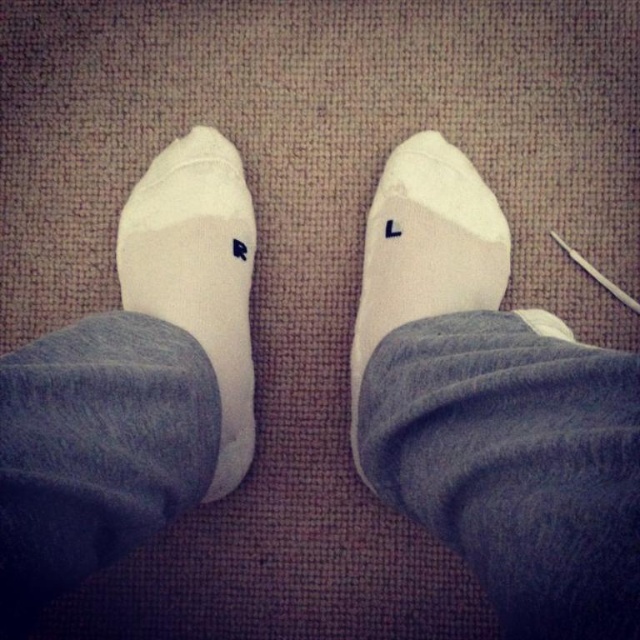
Question: Is white matte socks at left to the left of white soft socks at center from the viewer's perspective?

Choices:
 (A) yes
 (B) no

Answer: (A)

Question: From the image, what is the correct spatial relationship of white matte socks at left in relation to white soft socks at center?

Choices:
 (A) below
 (B) above

Answer: (A)

Question: Which point is closer to the camera?

Choices:
 (A) white soft socks at center
 (B) white matte socks at left

Answer: (B)

Question: Is white matte socks at left to the left of white soft socks at center from the viewer's perspective?

Choices:
 (A) no
 (B) yes

Answer: (B)